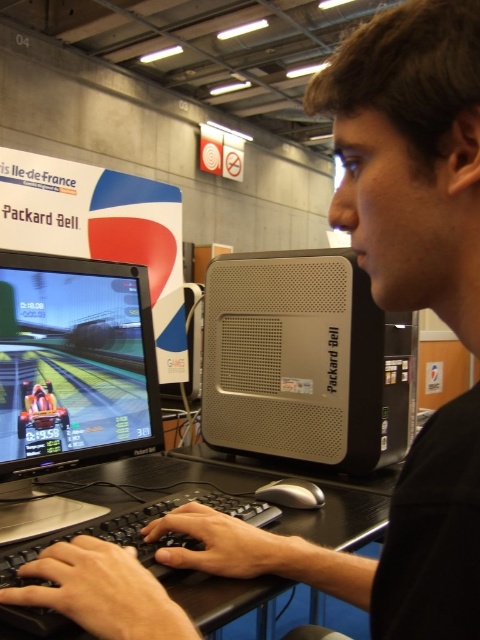
You are a delivery person who just arrived at the desk to place a new mouse. You need to put the mouse between the silver metallic computer at center and the black plastic keyboard at lower center. Which object should you place the mouse closer to based on their positions?

The silver metallic computer at center is further to the viewer than the black plastic keyboard at lower center, so you should place the mouse closer to the black plastic keyboard at lower center to position it between them.

You are setting up a new desk and want to place the black glossy monitor at left and the black plastic keyboard at lower center. Based on the scene, which object should be placed to the left of the other?

The black glossy monitor at left should be placed to the left of the black plastic keyboard at lower center, as it is positioned on the left side of the keyboard in the scene.

You are setting up a desk and want to place the silver metallic computer at center and the black plastic keyboard at lower center. Given their sizes, which object should you place first to ensure there is enough space for both?

The silver metallic computer at center occupies less space than the black plastic keyboard at lower center, so you should place the black plastic keyboard at lower center first to ensure proper arrangement and enough space for both items.